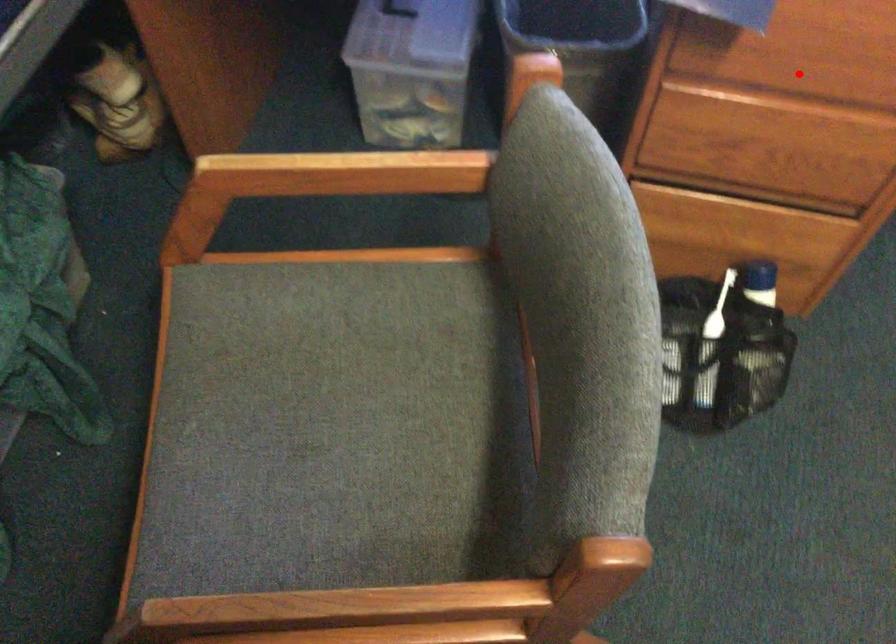
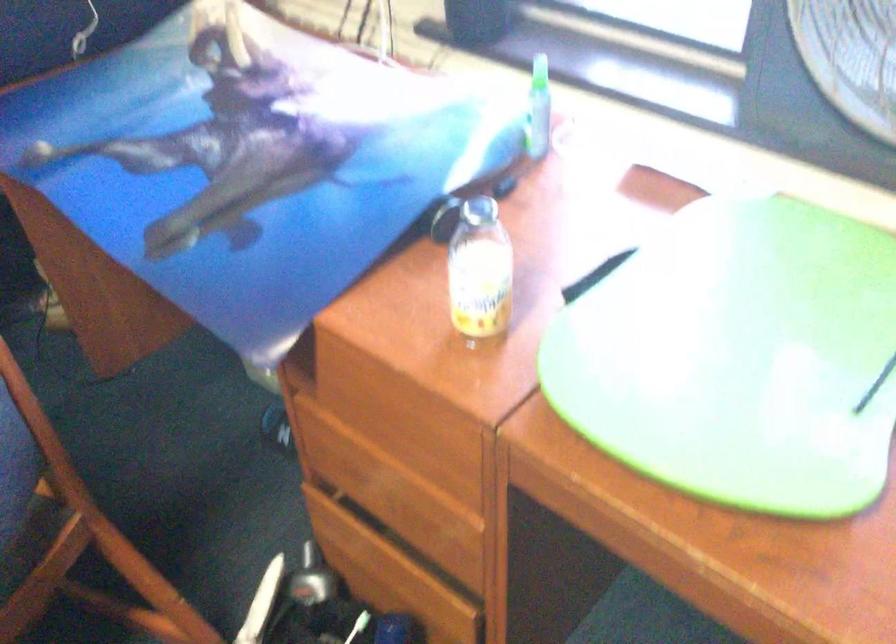
Locate, in the second image, the point that corresponds to the highlighted location in the first image.

(383, 435)